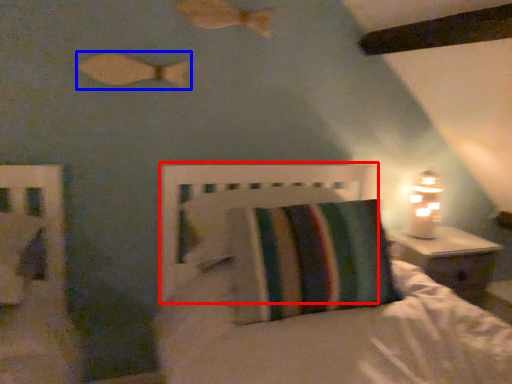
Question: Which point is further to the camera, headboard (highlighted by a red box) or fish (highlighted by a blue box)?

Choices:
 (A) headboard
 (B) fish

Answer: (B)